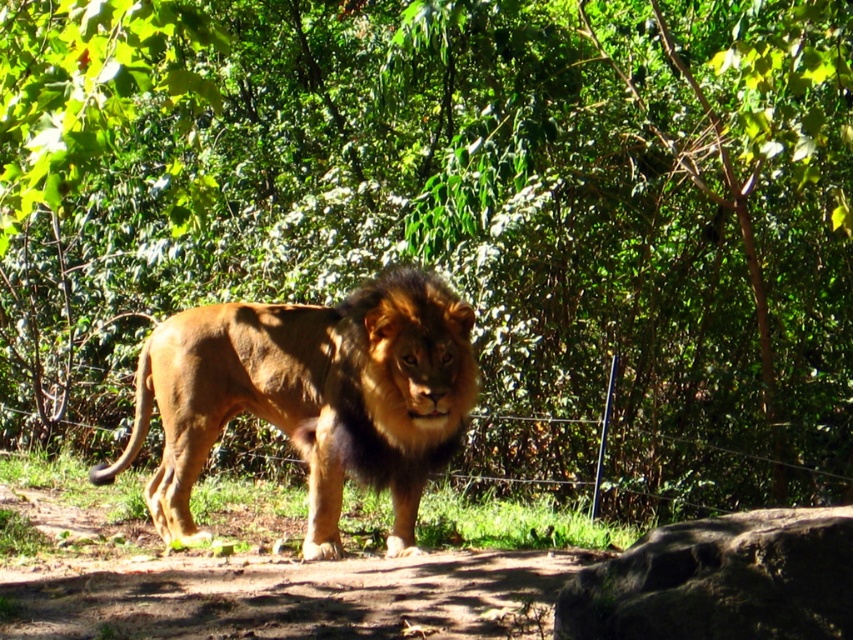
Question: Which object is closer to the camera taking this photo?

Choices:
 (A) golden fur lion at center
 (B) brown rough rock at lower right

Answer: (B)

Question: Can you confirm if golden fur lion at center is wider than brown rough rock at lower right?

Choices:
 (A) yes
 (B) no

Answer: (A)

Question: Is golden fur lion at center further to camera compared to brown rough rock at lower right?

Choices:
 (A) yes
 (B) no

Answer: (A)

Question: Among these objects, which one is farthest from the camera?

Choices:
 (A) golden fur lion at center
 (B) brown rough rock at lower right

Answer: (A)

Question: Which point appears closest to the camera in this image?

Choices:
 (A) (817, 515)
 (B) (291, 417)

Answer: (A)

Question: Is golden fur lion at center bigger than brown rough rock at lower right?

Choices:
 (A) no
 (B) yes

Answer: (B)